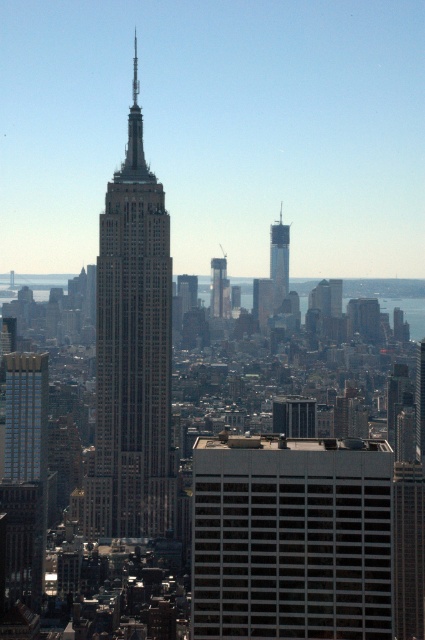
Question: Can you confirm if gray concrete building at center is positioned to the right of brown stone tower at center?

Choices:
 (A) yes
 (B) no

Answer: (A)

Question: Estimate the real-world distances between objects in this image. Which object is farther from the glassy steel skyscraper at center?

Choices:
 (A) gray concrete building at center
 (B) smooth glass skyscraper at center
 (C) brown stone tower at center

Answer: (A)

Question: Among these points, which one is farthest from the camera?

Choices:
 (A) (282, 278)
 (B) (229, 444)
 (C) (212, 305)

Answer: (B)

Question: Which point is closer to the camera?

Choices:
 (A) (107, 412)
 (B) (354, 467)
 (C) (224, 273)
 (D) (286, 275)

Answer: (C)

Question: Is gray concrete building at center further to camera compared to glassy steel skyscraper at center?

Choices:
 (A) yes
 (B) no

Answer: (A)

Question: Considering the relative positions of gray concrete building at center and smooth glass skyscraper at center in the image provided, where is gray concrete building at center located with respect to smooth glass skyscraper at center?

Choices:
 (A) right
 (B) left

Answer: (A)